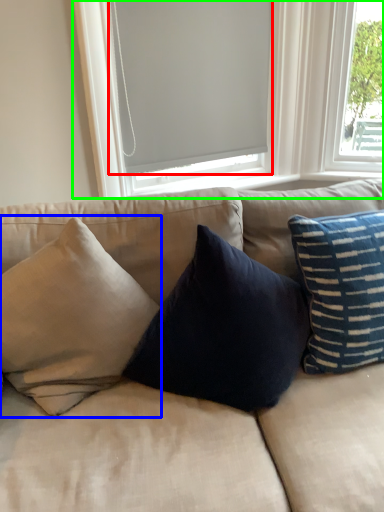
Question: Based on their relative distances, which object is farther from window screen (highlighted by a red box)? Choose from pillow (highlighted by a blue box) and window (highlighted by a green box).

Choices:
 (A) pillow
 (B) window

Answer: (A)